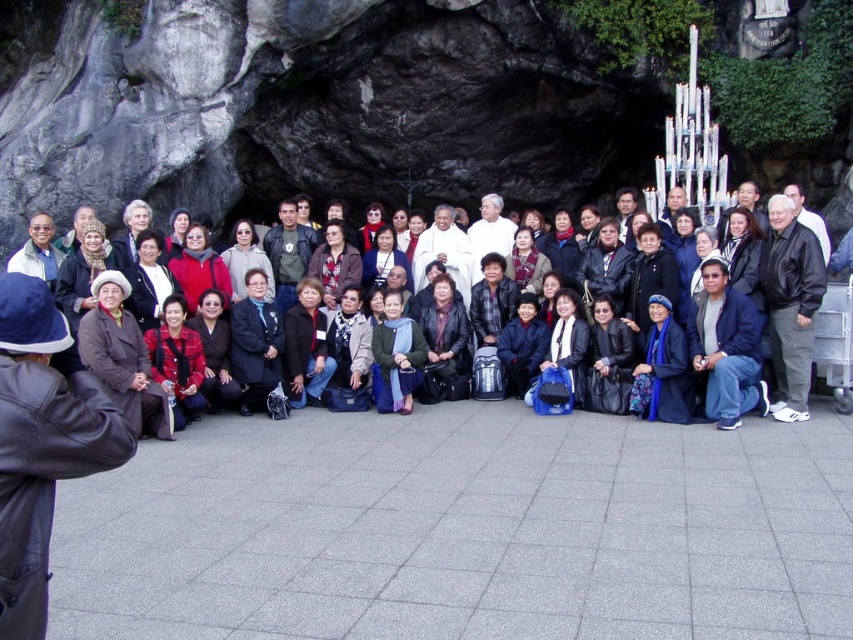
Question: Among these objects, which one is nearest to the camera?

Choices:
 (A) matte black jacket at center
 (B) black leather jacket at lower right

Answer: (A)

Question: Is matte black jacket at center below black leather jacket at lower right?

Choices:
 (A) no
 (B) yes

Answer: (B)

Question: Which point is farther to the camera?

Choices:
 (A) (756, 310)
 (B) (674, 342)

Answer: (A)

Question: Can you confirm if matte black jacket at center is positioned above black leather jacket at lower right?

Choices:
 (A) yes
 (B) no

Answer: (B)

Question: Can you confirm if black leather jacket at lower right is thinner than dark blue jacket at center?

Choices:
 (A) no
 (B) yes

Answer: (A)

Question: Estimate the real-world distances between objects in this image. Which object is closer to the dark blue jacket at center?

Choices:
 (A) black leather jacket at lower right
 (B) matte black jacket at center

Answer: (B)